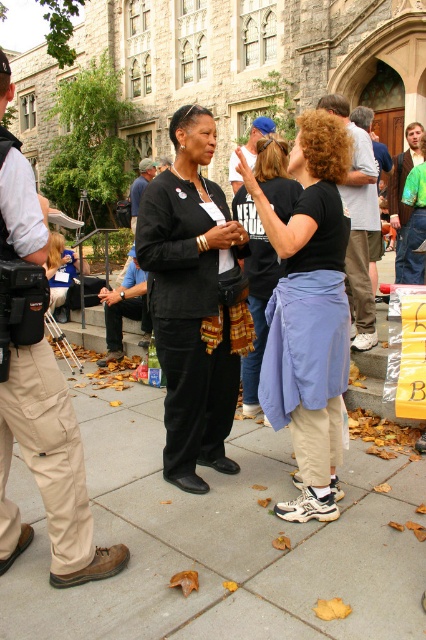
You are standing at the point marked by point [328,348] and want to walk to the point marked by point [195,355]. Which direction should you move relative to your current position?

Since point [195,355] is behind point [328,348], you should move backward to reach it.

You are a photographer trying to capture a candid shot of both the khaki cargo pants at left and the dark gray pants at center in the same frame. Based on their height difference, which pants should you focus on first to ensure they are both in the frame?

The khaki cargo pants at left is much taller than the dark gray pants at center, so you should focus on the khaki cargo pants at left first to ensure both are in the frame.